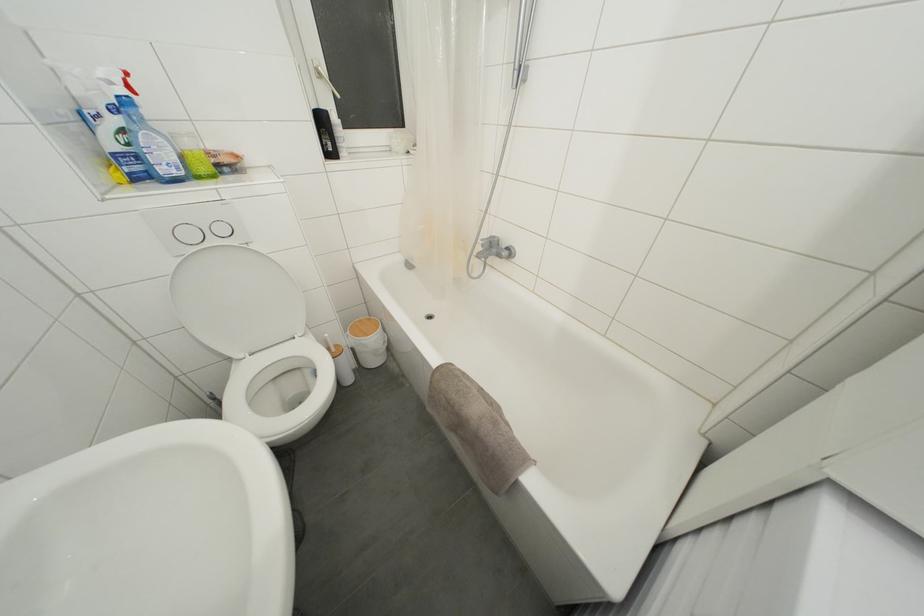
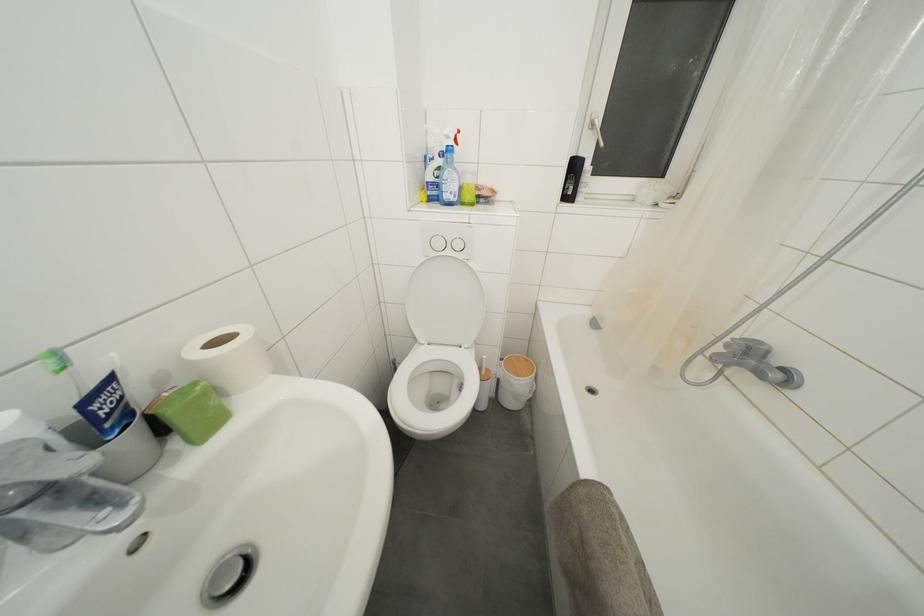
Find the pixel in the second image that matches (104,79) in the first image.

(450, 138)